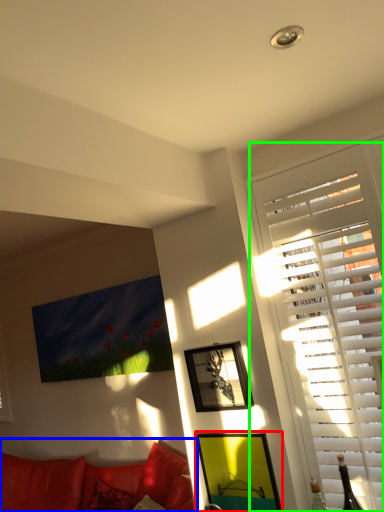
Question: Considering the real-world distances, which object is closest to picture frame (highlighted by a red box)? studio couch (highlighted by a blue box) or window (highlighted by a green box).

Choices:
 (A) studio couch
 (B) window

Answer: (B)